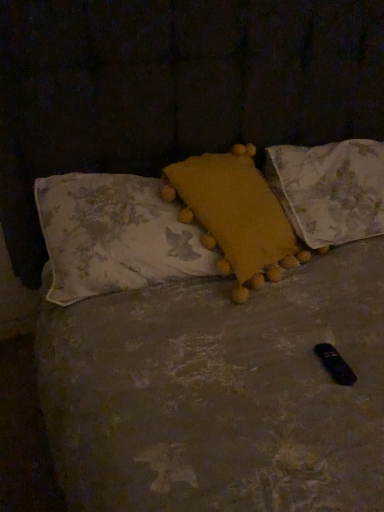
Question: In terms of width, does fluffy yellow pillow at center, which is the first pillow from left to right, look wider or thinner when compared to yellow fuzzy pillow at center, the second pillow in the left-to-right sequence?

Choices:
 (A) wide
 (B) thin

Answer: (B)

Question: Would you say fluffy yellow pillow at center, which is the first pillow from left to right, is inside or outside yellow fuzzy pillow at center, the second pillow in the left-to-right sequence?

Choices:
 (A) inside
 (B) outside

Answer: (A)

Question: Which object is positioned closest to the yellow fabric pillow at upper right, arranged as the 3th pillow when viewed from the left?

Choices:
 (A) yellow fuzzy pillow at center, marked as the second pillow in a right-to-left arrangement
 (B) fluffy yellow pillow at center, which is the first pillow from left to right

Answer: (A)

Question: Based on their relative distances, which object is farther from the yellow fuzzy pillow at center, the second pillow in the left-to-right sequence?

Choices:
 (A) fluffy yellow pillow at center, which is the first pillow from left to right
 (B) yellow fabric pillow at upper right, which is the first pillow from right to left

Answer: (B)